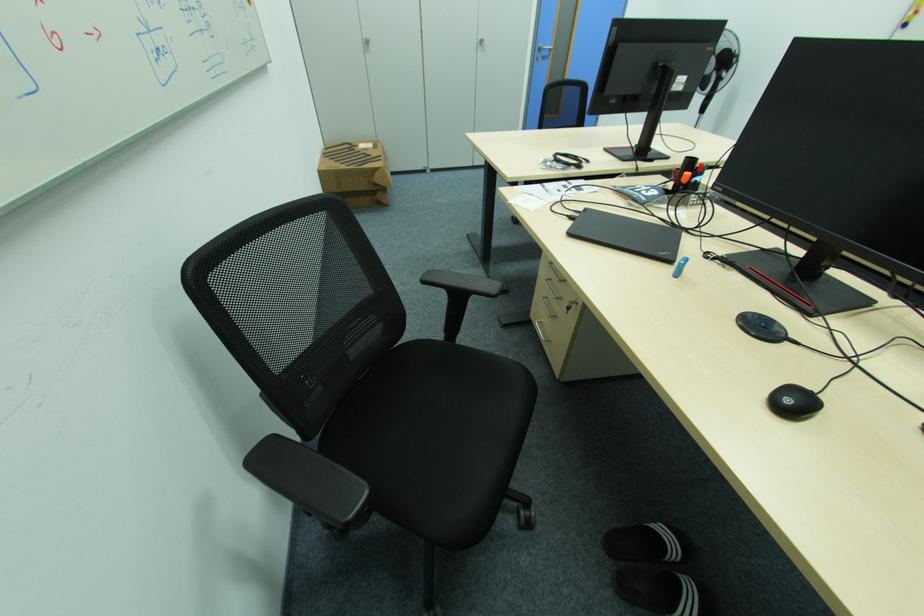
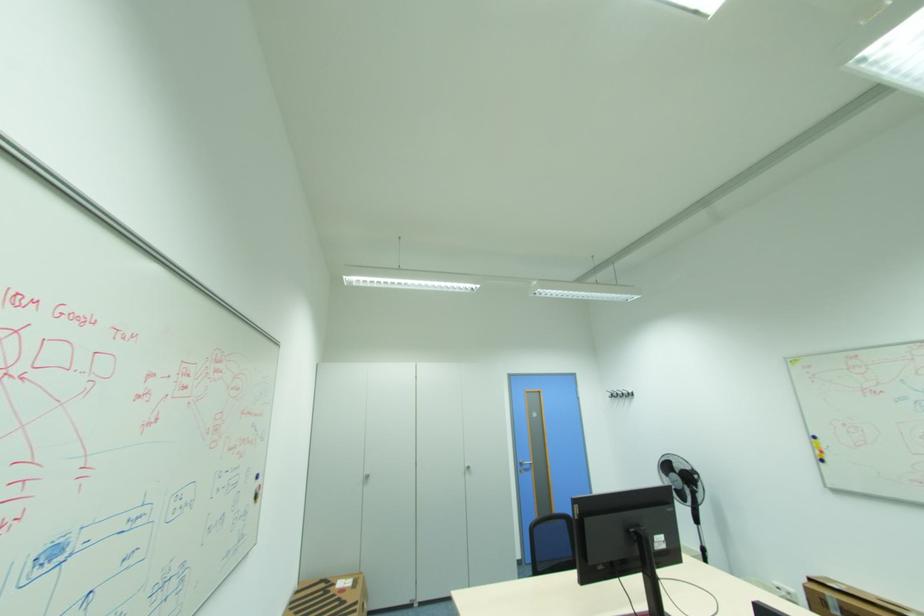
In the second image, find the point that corresponds to point 372,43 in the first image.

(372, 477)